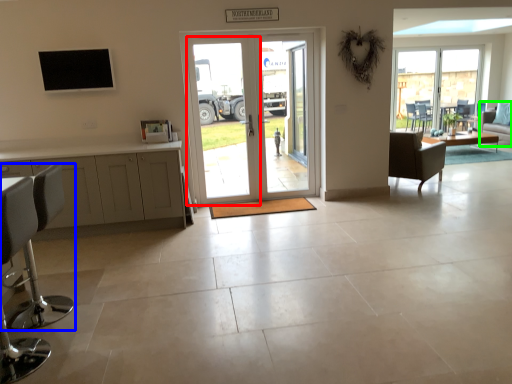
Question: Which is nearer to the screen door (highlighted by a red box)? chair (highlighted by a blue box) or couch (highlighted by a green box).

Choices:
 (A) chair
 (B) couch

Answer: (A)